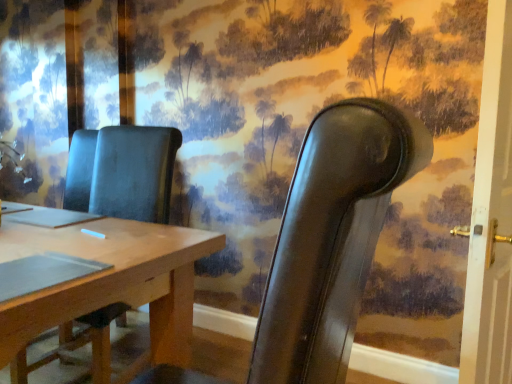
Measure the distance between leather chair at right, acting as the 2th chair starting from the left, and camera.

The depth of leather chair at right, acting as the 2th chair starting from the left, is 15.33 inches.

What do you see at coordinates (490, 216) in the screenshot?
I see `white painted wood door at right` at bounding box center [490, 216].

At what (x,y) coordinates should I click in order to perform the action: click on matte brown chair at center, which is counted as the 2th chair, starting from the right. Please return your answer as a coordinate pair (x, y). Looking at the image, I should click on (122, 172).

Is white painted wood door at right bigger or smaller than leather chair at right, acting as the 2th chair starting from the left?

Considering their sizes, white painted wood door at right takes up less space than leather chair at right, acting as the 2th chair starting from the left.

From a real-world perspective, starting from the white painted wood door at right, which chair is the 1st one below it? Please provide its 2D coordinates.

[(332, 238)]

Is point (480, 361) closer or farther from the camera than point (356, 132)?

Point (480, 361) is positioned farther from the camera compared to point (356, 132).

From a real-world perspective, which is physically above, matte brown chair at center, which is the 1th chair in left-to-right order, or white painted wood door at right?

white painted wood door at right, from a real-world perspective.

Where is `door on the right side of matte brown chair at center, which is the 1th chair in left-to-right order`? The image size is (512, 384). door on the right side of matte brown chair at center, which is the 1th chair in left-to-right order is located at coordinates (490, 216).

From the image's perspective, does matte brown chair at center, which is the 1th chair in left-to-right order, appear lower than white painted wood door at right?

Yes.

Between point (120, 167) and point (504, 268), which one is positioned in front?

The point (504, 268) is in front.

From the image's perspective, is leather chair at right, which appears as the 1th chair when viewed from the right, on top of matte brown chair at center, which is counted as the 2th chair, starting from the right?

Yes.

Considering the sizes of objects leather chair at right, acting as the 2th chair starting from the left, and matte brown chair at center, which is counted as the 2th chair, starting from the right, in the image provided, who is thinner, leather chair at right, acting as the 2th chair starting from the left, or matte brown chair at center, which is counted as the 2th chair, starting from the right,?

Thinner between the two is leather chair at right, acting as the 2th chair starting from the left.

The image size is (512, 384). What are the coordinates of `chair behind the leather chair at right, which appears as the 1th chair when viewed from the right` in the screenshot? It's located at (122, 172).

Does point (316, 273) come in front of point (100, 209)?

That is True.

Between white painted wood door at right and matte brown chair at center, which is counted as the 2th chair, starting from the right, which one has smaller width?

Thinner between the two is white painted wood door at right.

From the image's perspective, relative to matte brown chair at center, which is counted as the 2th chair, starting from the right, is white painted wood door at right above or below?

Based on their image positions, white painted wood door at right is located above matte brown chair at center, which is counted as the 2th chair, starting from the right.

Which is more to the left, white painted wood door at right or matte brown chair at center, which is counted as the 2th chair, starting from the right?

matte brown chair at center, which is counted as the 2th chair, starting from the right, is more to the left.

From a real-world perspective, does white painted wood door at right sit lower than matte brown chair at center, which is counted as the 2th chair, starting from the right?

Actually, white painted wood door at right is physically above matte brown chair at center, which is counted as the 2th chair, starting from the right, in the real world.

From the image's perspective, is leather chair at right, acting as the 2th chair starting from the left, located beneath white painted wood door at right?

Correct, leather chair at right, acting as the 2th chair starting from the left, appears lower than white painted wood door at right in the image.

The width and height of the screenshot is (512, 384). What are the coordinates of `door on the right of leather chair at right, acting as the 2th chair starting from the left` in the screenshot? It's located at (490, 216).

Does point (364, 256) come closer to viewer compared to point (486, 198)?

That is True.

From a real-world perspective, which object stands above the other?

From a 3D spatial view, white painted wood door at right is above.

Between matte brown chair at center, which is counted as the 2th chair, starting from the right, and leather chair at right, acting as the 2th chair starting from the left, which one has larger size?

Bigger between the two is matte brown chair at center, which is counted as the 2th chair, starting from the right.

Does matte brown chair at center, which is counted as the 2th chair, starting from the right, contain leather chair at right, acting as the 2th chair starting from the left?

No, leather chair at right, acting as the 2th chair starting from the left, is not surrounded by matte brown chair at center, which is counted as the 2th chair, starting from the right.

Is matte brown chair at center, which is the 1th chair in left-to-right order, oriented towards leather chair at right, which appears as the 1th chair when viewed from the right?

No, matte brown chair at center, which is the 1th chair in left-to-right order, is not aimed at leather chair at right, which appears as the 1th chair when viewed from the right.

In the scene shown: Does matte brown chair at center, which is the 1th chair in left-to-right order, lie behind leather chair at right, acting as the 2th chair starting from the left?

Yes, matte brown chair at center, which is the 1th chair in left-to-right order, is further from the viewer.

Identify the location of the 1st chair located beneath the white painted wood door at right (from a real-world perspective). (332, 238).

Find the location of `door above the matte brown chair at center, which is counted as the 2th chair, starting from the right (from the image's perspective)`. door above the matte brown chair at center, which is counted as the 2th chair, starting from the right (from the image's perspective) is located at coordinates (490, 216).

Based on their spatial positions, is white painted wood door at right or leather chair at right, acting as the 2th chair starting from the left, further from matte brown chair at center, which is counted as the 2th chair, starting from the right?

Among the two, leather chair at right, acting as the 2th chair starting from the left, is located further to matte brown chair at center, which is counted as the 2th chair, starting from the right.

Looking at the image, which one is located further to leather chair at right, which appears as the 1th chair when viewed from the right, matte brown chair at center, which is counted as the 2th chair, starting from the right, or white painted wood door at right?

Based on the image, matte brown chair at center, which is counted as the 2th chair, starting from the right, appears to be further to leather chair at right, which appears as the 1th chair when viewed from the right.

Which object lies further to the anchor point matte brown chair at center, which is the 1th chair in left-to-right order, leather chair at right, acting as the 2th chair starting from the left, or white painted wood door at right?

leather chair at right, acting as the 2th chair starting from the left.

Considering their positions, is leather chair at right, acting as the 2th chair starting from the left, positioned further to white painted wood door at right than matte brown chair at center, which is counted as the 2th chair, starting from the right?

matte brown chair at center, which is counted as the 2th chair, starting from the right.

From the image, which object appears to be farther from leather chair at right, acting as the 2th chair starting from the left, white painted wood door at right or matte brown chair at center, which is the 1th chair in left-to-right order?

Based on the image, matte brown chair at center, which is the 1th chair in left-to-right order, appears to be further to leather chair at right, acting as the 2th chair starting from the left.

Based on their spatial positions, is matte brown chair at center, which is counted as the 2th chair, starting from the right, or leather chair at right, which appears as the 1th chair when viewed from the right, closer to white painted wood door at right?

Based on the image, leather chair at right, which appears as the 1th chair when viewed from the right, appears to be nearer to white painted wood door at right.

This screenshot has height=384, width=512. I want to click on chair between matte brown chair at center, which is counted as the 2th chair, starting from the right, and white painted wood door at right from left to right, so click(332, 238).